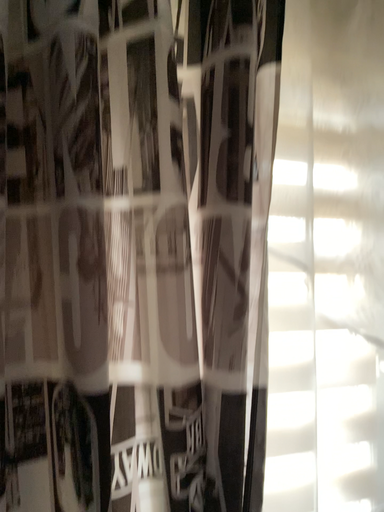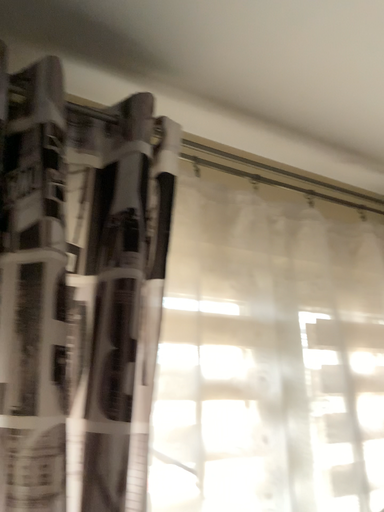
Question: Which way did the camera rotate in the video?

Choices:
 (A) rotated right
 (B) rotated left

Answer: (A)